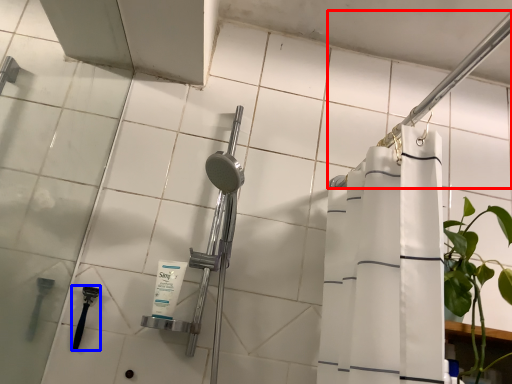
Question: Which object is further to the camera taking this photo, shower (highlighted by a red box) or shower (highlighted by a blue box)?

Choices:
 (A) shower
 (B) shower

Answer: (B)